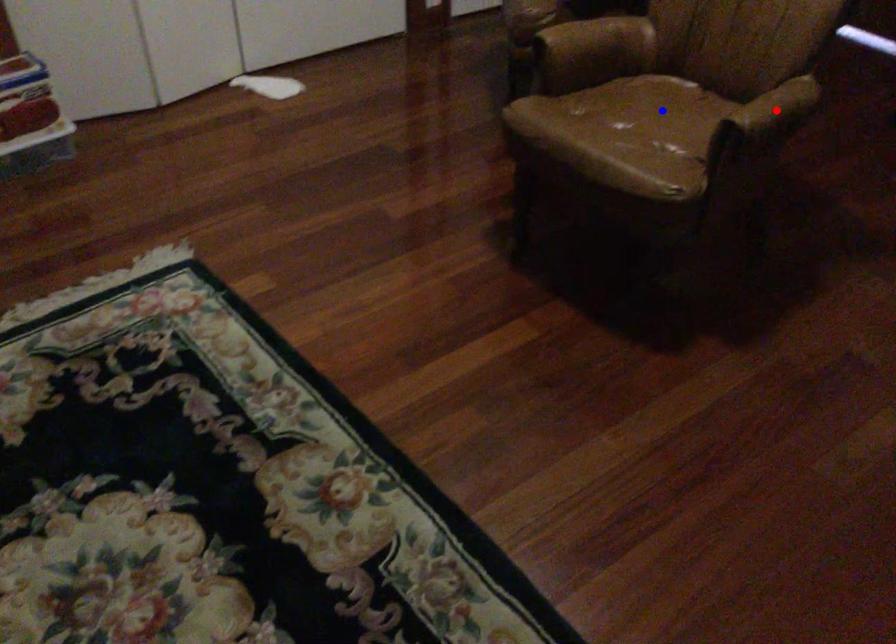
Question: In the image, two points are highlighted. Which point is nearer to the camera? Reply with the corresponding letter.

Choices:
 (A) blue point
 (B) red point

Answer: (B)